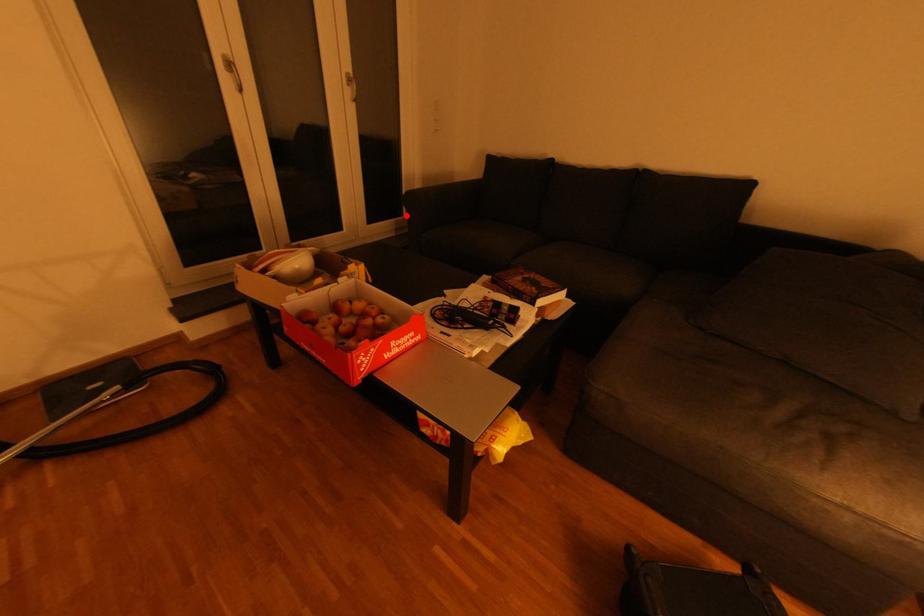
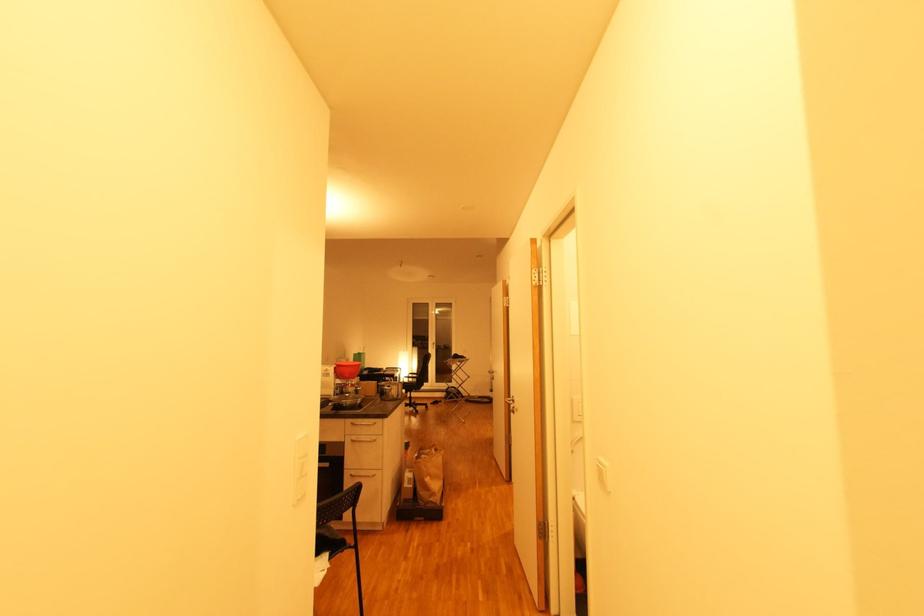
Question: I am providing you with two images of the same scene from different viewpoints. A red point is marked on the first image. Can you still see the location of the red point in image 2?

Choices:
 (A) Yes
 (B) No

Answer: (B)